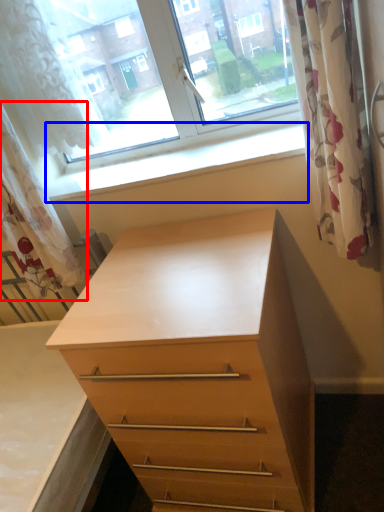
Question: Among these objects, which one is nearest to the camera, curtain (highlighted by a red box) or window sill (highlighted by a blue box)?

Choices:
 (A) curtain
 (B) window sill

Answer: (A)